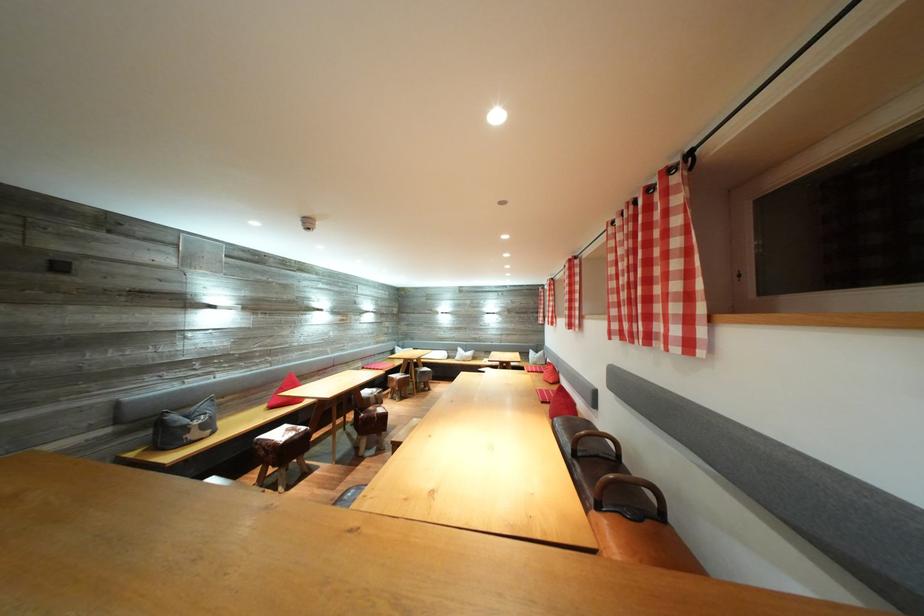
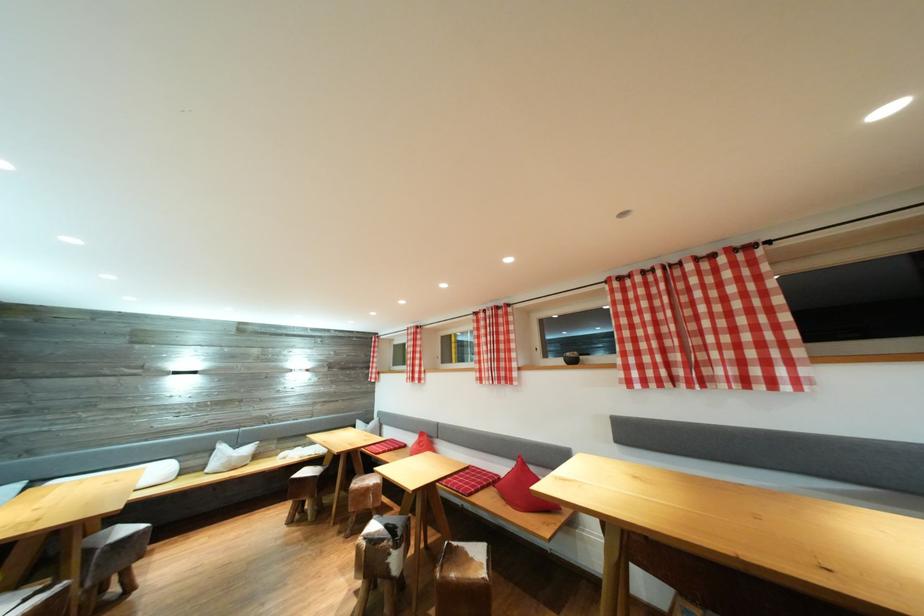
Locate, in the second image, the point that corresponds to (x=432, y=375) in the first image.

(131, 536)